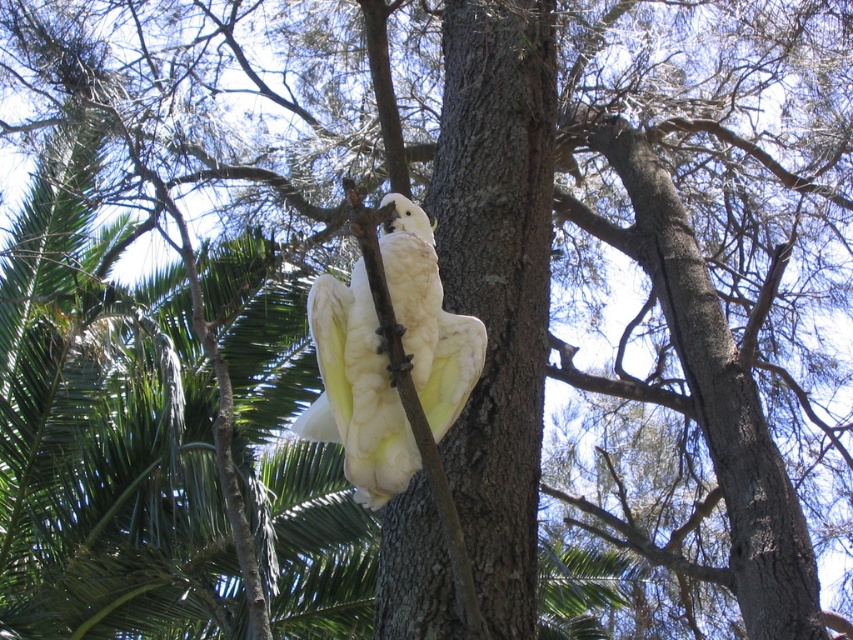
You are a birdwatcher trying to identify the tallest object between the brown rough tree trunk at center and the white feathered parrot at center in the image. Which one is taller?

The brown rough tree trunk at center is taller than the white feathered parrot at center according to the description.